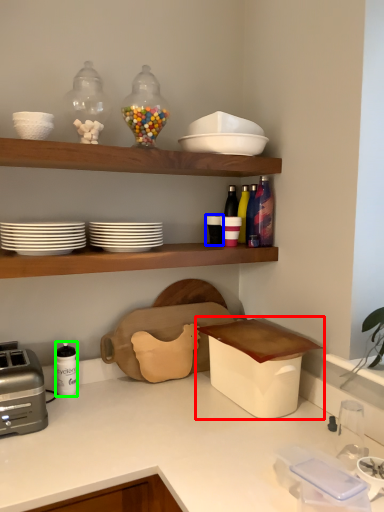
Question: Which is farther away from appliance (highlighted by a red box)? tableware (highlighted by a blue box) or tableware (highlighted by a green box)?

Choices:
 (A) tableware
 (B) tableware

Answer: (B)